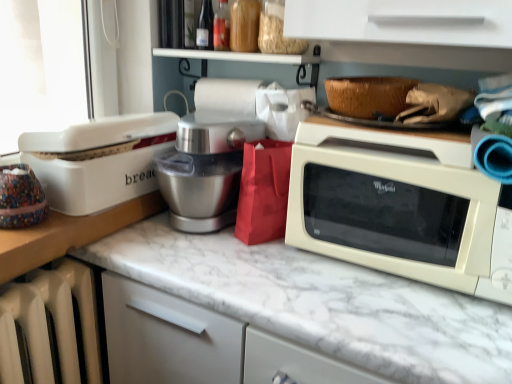
Locate an element on the screen. woven brown basket at upper right is located at coordinates pos(368,95).

You are a GUI agent. You are given a task and a screenshot of the screen. Output one action in this format:
    pyautogui.click(x=<x>, y=<y>)
    Task: Click on the silver metallic mixer at center
    
    Given the screenshot: What is the action you would take?
    pyautogui.click(x=205, y=168)

Locate an element on the screen. This screenshot has width=512, height=384. translucent glass bottle at upper center is located at coordinates (205, 27).

This screenshot has height=384, width=512. What do you see at coordinates (321, 302) in the screenshot?
I see `white marble countertop at center` at bounding box center [321, 302].

The image size is (512, 384). I want to click on woven brown basket at upper right, so click(368, 95).

From a real-world perspective, which object stands above the other?

translucent glass bottle at upper center, from a real-world perspective.

Identify the location of bottle above the woven brown basket at upper right (from a real-world perspective). (205, 27).

Which object is thinner, translucent glass bottle at upper center or woven brown basket at upper right?

translucent glass bottle at upper center is thinner.

How different are the orientations of translucent glass bottle at upper center and woven brown basket at upper right in degrees?

0.00199 degrees.

From the picture: Is white marble countertop at center located within woven brown basket at upper right?

No, white marble countertop at center is not surrounded by woven brown basket at upper right.

Is point (401, 87) closer or farther from the camera than point (251, 272)?

Point (401, 87) is positioned closer to the camera compared to point (251, 272).

Which object is further away from the camera taking this photo, woven brown basket at upper right or white marble countertop at center?

woven brown basket at upper right is further from the camera.

Does woven brown basket at upper right turn towards white marble countertop at center?

No, woven brown basket at upper right is not turned towards white marble countertop at center.

Find the location of `shelf that is on the left side of woven brown basket at upper right`. shelf that is on the left side of woven brown basket at upper right is located at coordinates (239, 56).

Which object is further away from the camera, translucent glass jars at upper center or woven brown basket at upper right?

translucent glass jars at upper center is behind.

From the image's perspective, would you say translucent glass jars at upper center is positioned over woven brown basket at upper right?

Yes.

Is silver metallic mixer at center not close to translucent glass jars at upper center?

They are positioned close to each other.

Visually, is silver metallic mixer at center positioned to the left or to the right of translucent glass jars at upper center?

From the image, it's evident that silver metallic mixer at center is to the left of translucent glass jars at upper center.

Is silver metallic mixer at center facing away from translucent glass jars at upper center?

No.

The height and width of the screenshot is (384, 512). I want to click on appliance in front of the silver metallic mixer at center, so click(x=98, y=160).

Does silver metallic mixer at center have a lesser width compared to white plastic bread box at left?

Correct, the width of silver metallic mixer at center is less than that of white plastic bread box at left.

Is silver metallic mixer at center far away from white plastic bread box at left?

No, silver metallic mixer at center is in close proximity to white plastic bread box at left.

From a real-world perspective, which object stands above the other?

From a 3D spatial view, translucent glass jars at upper center is above.

Is white glossy microwave at right wider than translucent glass jars at upper center?

Yes.

Locate an element on the screen. This screenshot has height=384, width=512. shelf above the white glossy microwave at right (from the image's perspective) is located at coordinates (239, 56).

Is white plastic bread box at left at the right side of translucent glass jars at upper center?

In fact, white plastic bread box at left is to the left of translucent glass jars at upper center.

From a real-world perspective, is white plastic bread box at left on top of translucent glass jars at upper center?

Actually, white plastic bread box at left is physically below translucent glass jars at upper center in the real world.

At what (x,y) coordinates should I click in order to perform the action: click on appliance below the translucent glass jars at upper center (from a real-world perspective). Please return your answer as a coordinate pair (x, y). This screenshot has width=512, height=384. Looking at the image, I should click on (98, 160).

Are white plastic bread box at left and translucent glass jars at upper center located far from each other?

No, white plastic bread box at left is not far from translucent glass jars at upper center.

Find the location of `basket below the translucent glass bottle at upper center (from a real-world perspective)`. basket below the translucent glass bottle at upper center (from a real-world perspective) is located at coordinates (x=368, y=95).

Find the location of `basket behind the white marble countertop at center`. basket behind the white marble countertop at center is located at coordinates point(368,95).

Which object lies further to the anchor point woven brown basket at upper right, white glossy microwave at right or translucent glass jars at upper center?

translucent glass jars at upper center is further to woven brown basket at upper right.

Which object lies further to the anchor point white marble countertop at center, silver metallic mixer at center or translucent glass jars at upper center?

Based on the image, translucent glass jars at upper center appears to be further to white marble countertop at center.

Estimate the real-world distances between objects in this image. Which object is further from white plastic bread box at left, silver metallic mixer at center or white marble countertop at center?

The object further to white plastic bread box at left is white marble countertop at center.

Based on their spatial positions, is white glossy microwave at right or translucent glass jars at upper center closer to white plastic bread box at left?

translucent glass jars at upper center lies closer to white plastic bread box at left than the other object.

Considering their positions, is translucent glass bottle at upper center positioned closer to translucent glass jars at upper center than white marble countertop at center?

Among the two, translucent glass bottle at upper center is located nearer to translucent glass jars at upper center.

When comparing their distances from white glossy microwave at right, does white marble countertop at center or woven brown basket at upper right seem closer?

white marble countertop at center lies closer to white glossy microwave at right than the other object.

Estimate the real-world distances between objects in this image. Which object is closer to white marble countertop at center, translucent glass bottle at upper center or translucent glass jars at upper center?

translucent glass jars at upper center.

In the scene shown: Estimate the real-world distances between objects in this image. Which object is closer to translucent glass bottle at upper center, white marble countertop at center or translucent glass jars at upper center?

translucent glass jars at upper center is positioned closer to the anchor translucent glass bottle at upper center.

Image resolution: width=512 pixels, height=384 pixels. In order to click on appliance between translucent glass bottle at upper center and silver metallic mixer at center in the up-down direction in this screenshot , I will do `click(98, 160)`.

Identify the location of mixer located between white plastic bread box at left and woven brown basket at upper right in the left-right direction. (205, 168).

Find the location of a particular element. Image resolution: width=512 pixels, height=384 pixels. appliance between woven brown basket at upper right and white marble countertop at center from top to bottom is located at coordinates point(98,160).

The image size is (512, 384). In order to click on microwave oven between silver metallic mixer at center and white marble countertop at center in the vertical direction in this screenshot , I will do `click(399, 206)`.